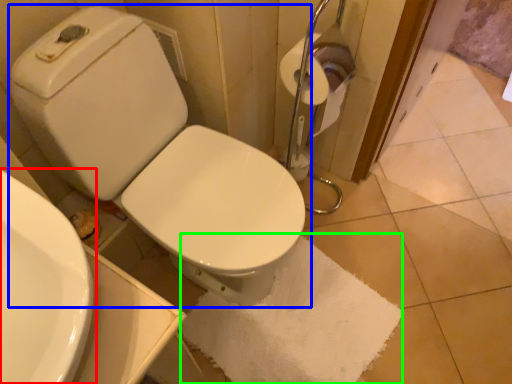
Question: Estimate the real-world distances between objects in this image. Which object is farther from sink (highlighted by a red box), toilet (highlighted by a blue box) or bath towel (highlighted by a green box)?

Choices:
 (A) toilet
 (B) bath towel

Answer: (B)